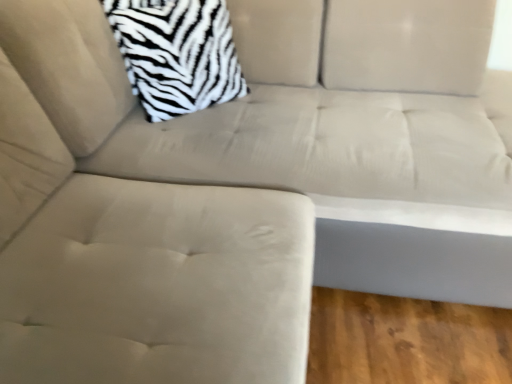
Question: Can you confirm if suede beige swivel chair at center is shorter than zebra-patterned fabric pillow at upper left?

Choices:
 (A) yes
 (B) no

Answer: (B)

Question: Is suede beige swivel chair at center aimed at zebra-patterned fabric pillow at upper left?

Choices:
 (A) yes
 (B) no

Answer: (B)

Question: Considering the relative positions of suede beige swivel chair at center and zebra-patterned fabric pillow at upper left in the image provided, is suede beige swivel chair at center to the left of zebra-patterned fabric pillow at upper left from the viewer's perspective?

Choices:
 (A) no
 (B) yes

Answer: (B)

Question: Does suede beige swivel chair at center have a greater width compared to zebra-patterned fabric pillow at upper left?

Choices:
 (A) yes
 (B) no

Answer: (A)

Question: From a real-world perspective, is suede beige swivel chair at center physically above zebra-patterned fabric pillow at upper left?

Choices:
 (A) yes
 (B) no

Answer: (B)

Question: From a real-world perspective, is suede beige swivel chair at center beneath zebra-patterned fabric pillow at upper left?

Choices:
 (A) yes
 (B) no

Answer: (A)

Question: Is zebra-patterned fabric pillow at upper left completely or partially outside of suede beige swivel chair at center?

Choices:
 (A) yes
 (B) no

Answer: (A)

Question: Is zebra-patterned fabric pillow at upper left closer to camera compared to suede beige swivel chair at center?

Choices:
 (A) no
 (B) yes

Answer: (A)

Question: Does zebra-patterned fabric pillow at upper left have a lesser width compared to suede beige swivel chair at center?

Choices:
 (A) no
 (B) yes

Answer: (B)

Question: Does zebra-patterned fabric pillow at upper left have a larger size compared to suede beige swivel chair at center?

Choices:
 (A) yes
 (B) no

Answer: (B)

Question: Is zebra-patterned fabric pillow at upper left taller than suede beige swivel chair at center?

Choices:
 (A) yes
 (B) no

Answer: (B)

Question: From the image's perspective, is zebra-patterned fabric pillow at upper left above suede beige swivel chair at center?

Choices:
 (A) yes
 (B) no

Answer: (A)

Question: Is point (72, 319) positioned closer to the camera than point (135, 86)?

Choices:
 (A) farther
 (B) closer

Answer: (B)